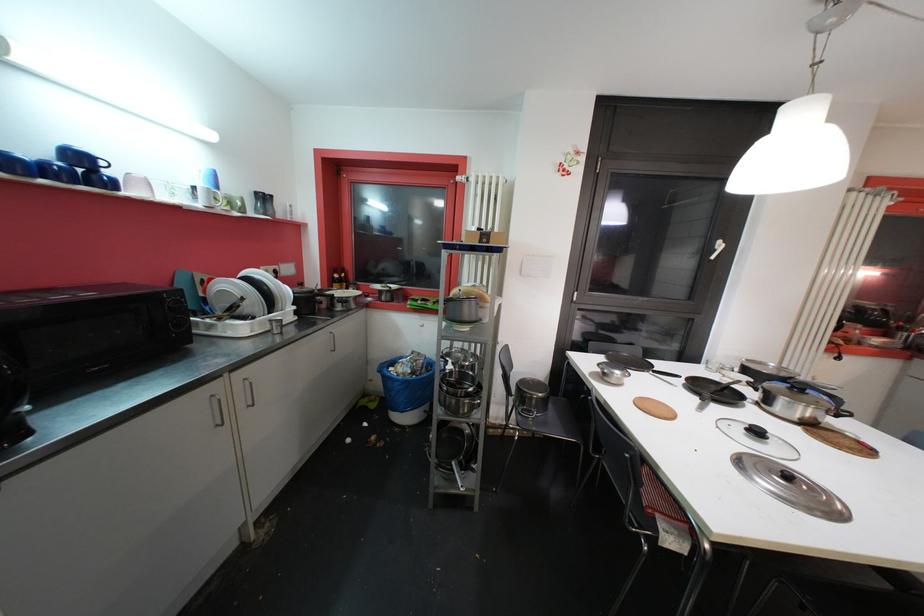
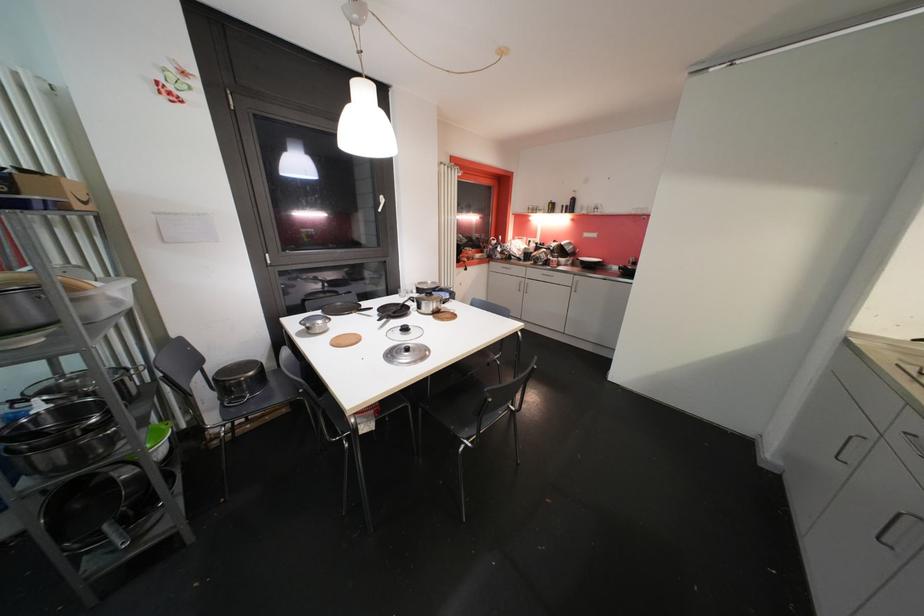
Where in the second image is the point corresponding to [617,376] from the first image?

(319, 328)